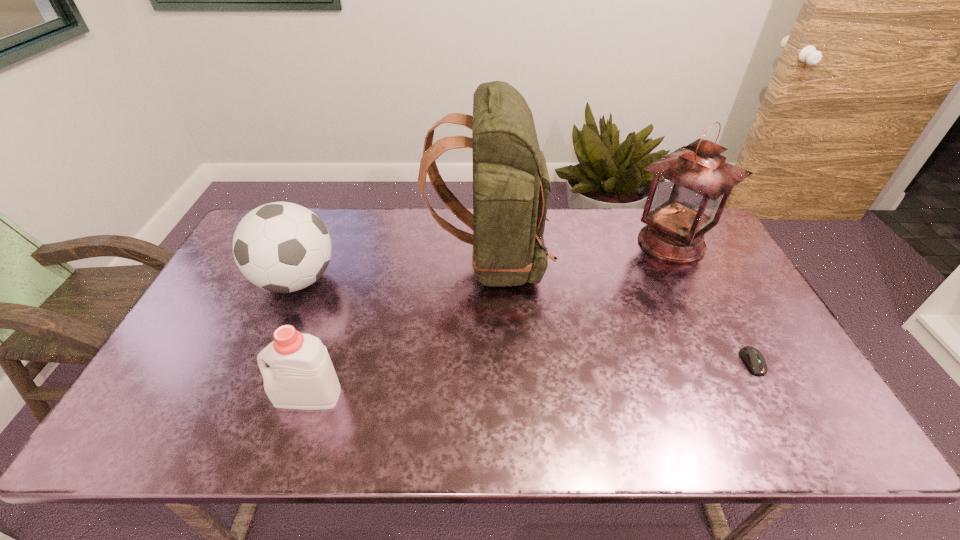
The image size is (960, 540). Identify the location of computer equipment that is at the right edge. (752, 356).

Image resolution: width=960 pixels, height=540 pixels. I want to click on object positioned at the far right corner, so click(690, 188).

Identify the location of free space at the far edge of the desktop. This screenshot has height=540, width=960. (617, 231).

The height and width of the screenshot is (540, 960). Identify the location of vacant region at the near edge. (444, 440).

Image resolution: width=960 pixels, height=540 pixels. Find the location of `blank area at the left edge`. blank area at the left edge is located at coordinates (194, 340).

Find the location of a particular element. The image size is (960, 540). free location at the near right corner of the desktop is located at coordinates (827, 424).

Find the location of a particular element. free space between the third object from left to right and the computer equipment is located at coordinates (621, 311).

Locate an element on the screen. vacant area that lies between the backpack and the detergent is located at coordinates (398, 328).

Locate an element on the screen. The height and width of the screenshot is (540, 960). free area in between the nearest object and the fourth farthest object is located at coordinates (530, 379).

Where is `vacant space in between the second tallest object and the computer equipment`? The image size is (960, 540). vacant space in between the second tallest object and the computer equipment is located at coordinates (711, 302).